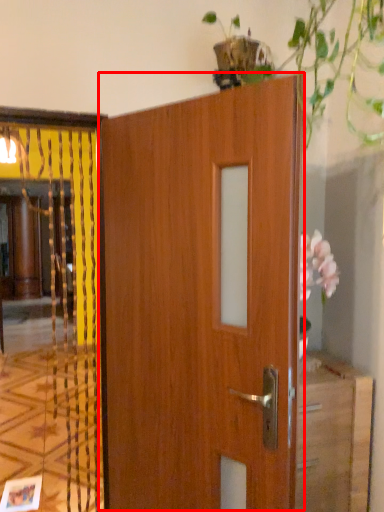
Question: Considering the relative positions of door (annotated by the red box) and elevator in the image provided, where is door (annotated by the red box) located with respect to the staircase?

Choices:
 (A) left
 (B) right

Answer: (B)